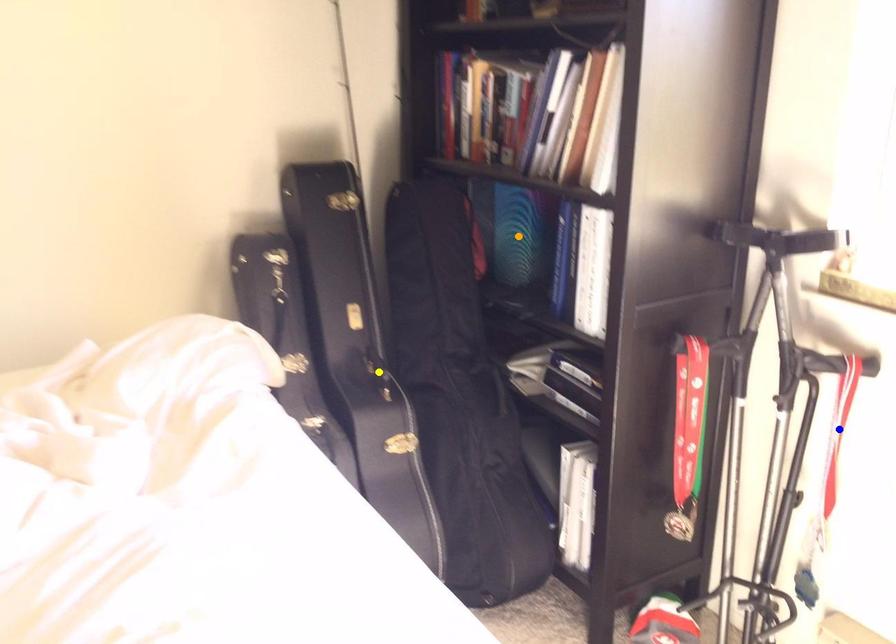
Order these from nearest to farthest:
1. orange point
2. blue point
3. yellow point

1. orange point
2. yellow point
3. blue point